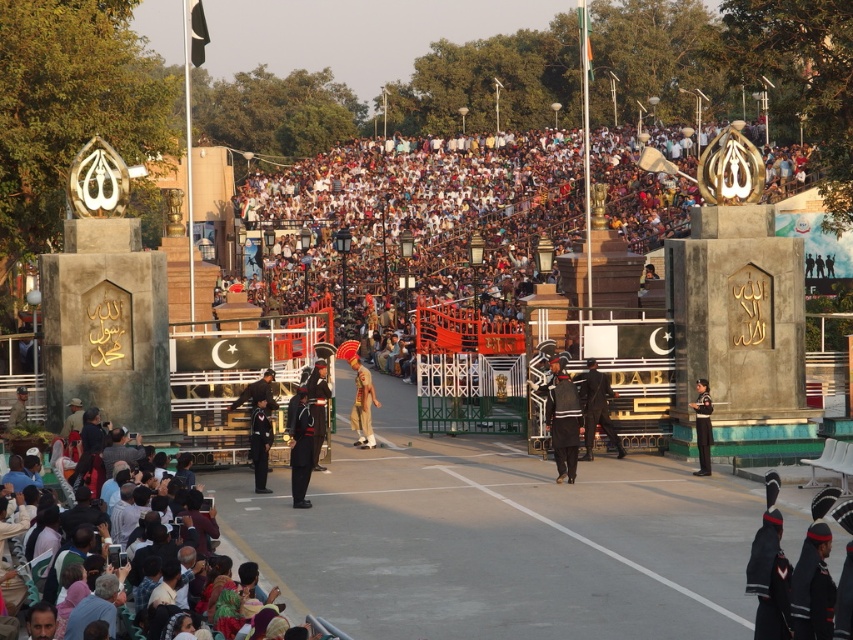
Question: Is dark brown fabric crowd at center above khaki uniform at center?

Choices:
 (A) yes
 (B) no

Answer: (B)

Question: Which object is closer to the camera taking this photo?

Choices:
 (A) dark blue uniform at center
 (B) dark brown fabric crowd at center

Answer: (B)

Question: Can you confirm if khaki uniform at center is bigger than dark blue uniform at center?

Choices:
 (A) no
 (B) yes

Answer: (B)

Question: Estimate the real-world distances between objects in this image. Which object is closer to the dark blue uniform at center?

Choices:
 (A) dark brown fabric crowd at center
 (B) dark brown crowd at center
 (C) khaki uniform at center

Answer: (A)

Question: Which point is closer to the camera?

Choices:
 (A) (577, 180)
 (B) (375, 397)

Answer: (B)

Question: Is dark brown crowd at center positioned in front of dark blue uniform at center?

Choices:
 (A) no
 (B) yes

Answer: (A)